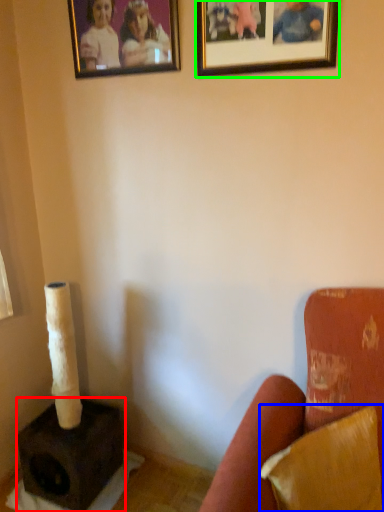
Question: Which is farther away from speaker (highlighted by a red box)? pillow (highlighted by a blue box) or picture frame (highlighted by a green box)?

Choices:
 (A) pillow
 (B) picture frame

Answer: (B)